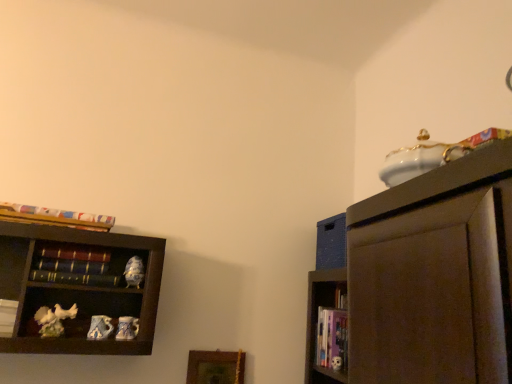
Question: Is multicolored paper at upper left, marked as the fourth book in a right-to-left arrangement, thinner than white matte book at left, which ranks as the 4th book in top-to-bottom order?

Choices:
 (A) no
 (B) yes

Answer: (B)

Question: Does multicolored paper at upper left, marked as the fourth book in a right-to-left arrangement, turn towards white matte book at left, the second book in the bottom-to-top sequence?

Choices:
 (A) no
 (B) yes

Answer: (A)

Question: Is the position of multicolored paper at upper left, the 2th book positioned from the left, more distant than that of white matte book at left, which ranks as the 4th book in top-to-bottom order?

Choices:
 (A) yes
 (B) no

Answer: (B)

Question: Is multicolored paper at upper left, arranged as the 1th book when viewed from the top, not close to white matte book at left, the second book in the bottom-to-top sequence?

Choices:
 (A) yes
 (B) no

Answer: (B)

Question: Is multicolored paper at upper left, arranged as the 1th book when viewed from the top, placed right next to white matte book at left, the second book in the bottom-to-top sequence?

Choices:
 (A) yes
 (B) no

Answer: (B)

Question: Is white matte book at left, which ranks as the 5th book in right-to-left order, taller or shorter than matte ceramic bird at lower left, which ranks as the second toy in bottom-to-top order?

Choices:
 (A) short
 (B) tall

Answer: (B)

Question: Considering the positions of white matte book at left, marked as the 1th book in a left-to-right arrangement, and matte ceramic bird at lower left, which ranks as the second toy in bottom-to-top order, in the image, is white matte book at left, marked as the 1th book in a left-to-right arrangement, wider or thinner than matte ceramic bird at lower left, which ranks as the second toy in bottom-to-top order,?

Choices:
 (A) thin
 (B) wide

Answer: (B)

Question: Is white matte book at left, marked as the 1th book in a left-to-right arrangement, to the left or to the right of matte ceramic bird at lower left, which ranks as the second toy in bottom-to-top order, in the image?

Choices:
 (A) right
 (B) left

Answer: (B)

Question: Is point (10, 336) closer or farther from the camera than point (103, 337)?

Choices:
 (A) closer
 (B) farther

Answer: (A)

Question: From the image's perspective, is porcelain mug at lower left, which is counted as the first toy, starting from the bottom, positioned above or below hardcover book at left, arranged as the 2th book when viewed from the right?

Choices:
 (A) below
 (B) above

Answer: (A)

Question: Based on their sizes in the image, would you say porcelain mug at lower left, which is counted as the first toy, starting from the bottom, is bigger or smaller than hardcover book at left, the third book from the top?

Choices:
 (A) small
 (B) big

Answer: (A)

Question: Considering the relative positions of porcelain mug at lower left, which is counted as the 3th toy, starting from the top, and hardcover book at left, which ranks as the 4th book in left-to-right order, in the image provided, is porcelain mug at lower left, which is counted as the 3th toy, starting from the top, to the left or to the right of hardcover book at left, which ranks as the 4th book in left-to-right order,?

Choices:
 (A) right
 (B) left

Answer: (A)

Question: Is porcelain mug at lower left, which is counted as the 3th toy, starting from the top, in front of or behind hardcover book at left, arranged as the 2th book when viewed from the right, in the image?

Choices:
 (A) behind
 (B) front

Answer: (A)

Question: From a real-world perspective, relative to white matte book at left, marked as the 1th book in a left-to-right arrangement, is wooden picture frame at lower center vertically above or below?

Choices:
 (A) above
 (B) below

Answer: (B)

Question: From the image's perspective, is wooden picture frame at lower center positioned above or below white matte book at left, which ranks as the 5th book in right-to-left order?

Choices:
 (A) above
 (B) below

Answer: (B)